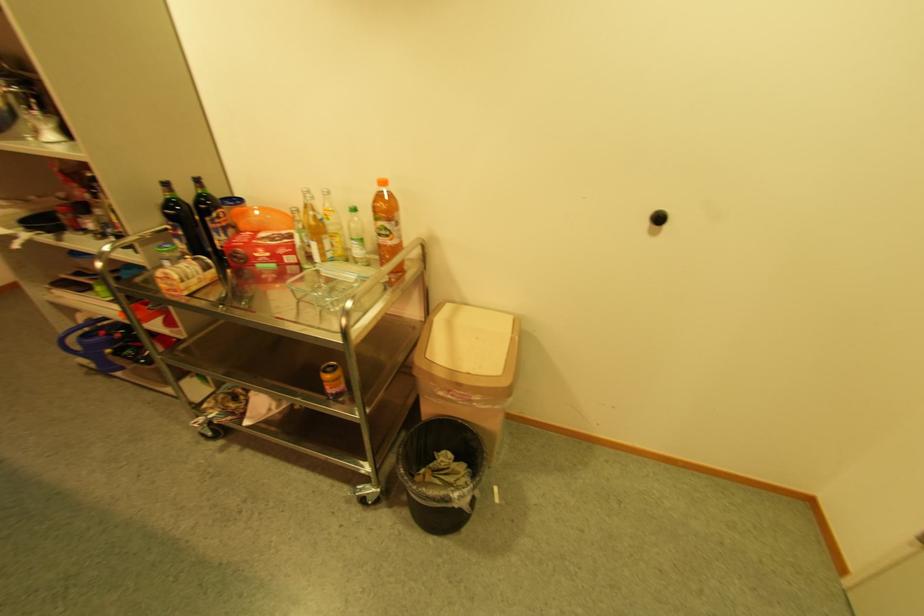
The height and width of the screenshot is (616, 924). What do you see at coordinates (126, 249) in the screenshot?
I see `the metal cart handle` at bounding box center [126, 249].